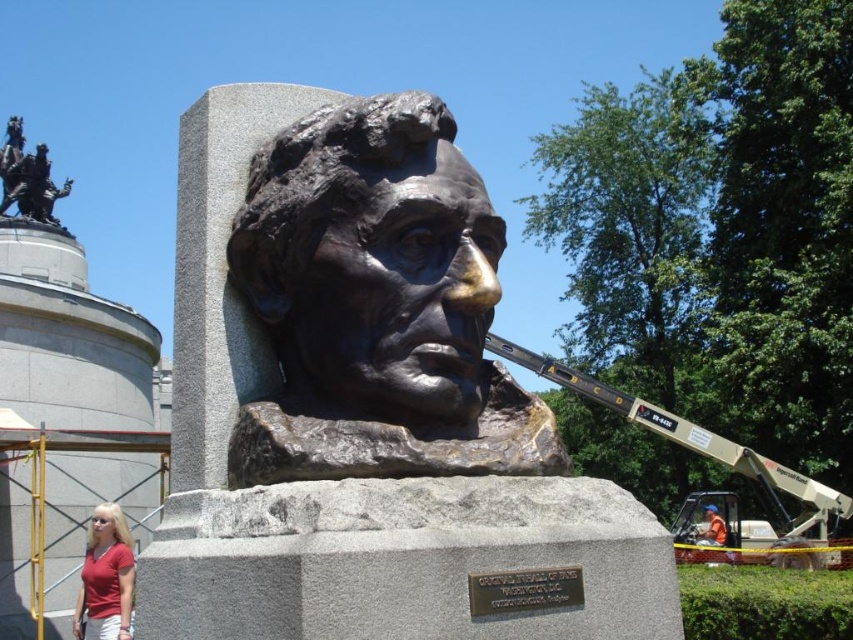
Question: Does bronze sculpture at center have a greater width compared to matte red shirt at lower left?

Choices:
 (A) no
 (B) yes

Answer: (B)

Question: Based on their relative distances, which object is farther from the bronze bust at center?

Choices:
 (A) bronze statue at upper left
 (B) matte red shirt at lower left

Answer: (A)

Question: Does bronze bust at center appear over matte red shirt at lower left?

Choices:
 (A) yes
 (B) no

Answer: (A)

Question: Does bronze bust at center have a larger size compared to bronze statue at upper left?

Choices:
 (A) no
 (B) yes

Answer: (A)

Question: Among these points, which one is farthest from the camera?

Choices:
 (A) (399, 193)
 (B) (712, 532)
 (C) (461, 289)
 (D) (80, 605)

Answer: (B)

Question: Which object is farther from the camera taking this photo?

Choices:
 (A) orange fabric at lower right
 (B) bronze statue at upper left
 (C) bronze bust at center
 (D) matte red shirt at lower left

Answer: (B)